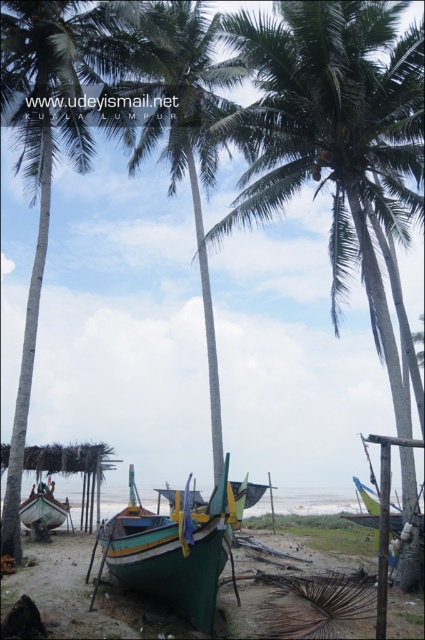
Question: Which point is closer to the camera?

Choices:
 (A) (272, 42)
 (B) (187, 600)
 (C) (61, 522)

Answer: (B)

Question: Which point is farther from the camera taking this photo?

Choices:
 (A) (368, 506)
 (B) (173, 598)
 (C) (195, 124)
 (D) (218, 221)

Answer: (D)

Question: Is green leafy coconut tree at center below green leafy palm tree at center?

Choices:
 (A) no
 (B) yes

Answer: (B)

Question: Does green leafy coconut tree at center have a lesser width compared to green fabric boat at lower right?

Choices:
 (A) yes
 (B) no

Answer: (B)

Question: Can you confirm if green leafy palm tree at center is positioned to the left of green matte boat at lower left?

Choices:
 (A) no
 (B) yes

Answer: (A)

Question: Which object is positioned closest to the green matte boat at lower left?

Choices:
 (A) green leafy palm tree at center
 (B) green matte boat at center

Answer: (B)